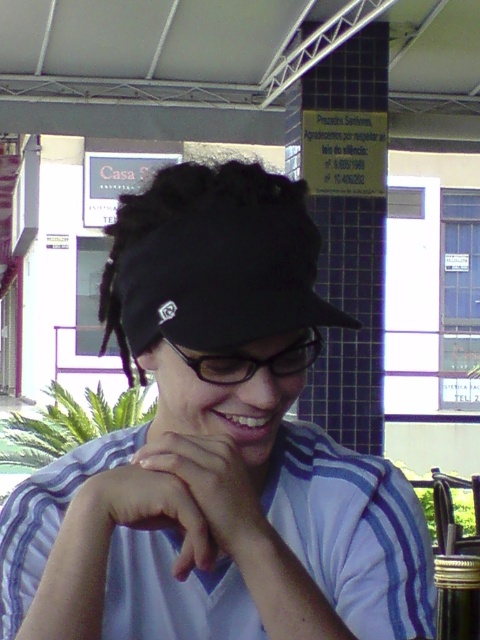
Question: Does white matte baseball cap at center appear on the right side of white matte hand at center?

Choices:
 (A) no
 (B) yes

Answer: (A)

Question: Does white matte baseball cap at center come in front of white matte hand at center?

Choices:
 (A) no
 (B) yes

Answer: (B)

Question: Is the position of white matte baseball cap at center more distant than that of white matte hand at center?

Choices:
 (A) no
 (B) yes

Answer: (A)

Question: Among these points, which one is nearest to the camera?

Choices:
 (A) (312, 328)
 (B) (171, 433)
 (C) (260, 394)

Answer: (C)

Question: Which object appears closest to the camera in this image?

Choices:
 (A) white striped polo shirt at center
 (B) black plastic glasses at center
 (C) white matte baseball cap at center
 (D) white matte hand at center

Answer: (C)

Question: Estimate the real-world distances between objects in this image. Which object is farther from the white matte hand at center?

Choices:
 (A) black plastic glasses at center
 (B) white matte baseball cap at center

Answer: (B)